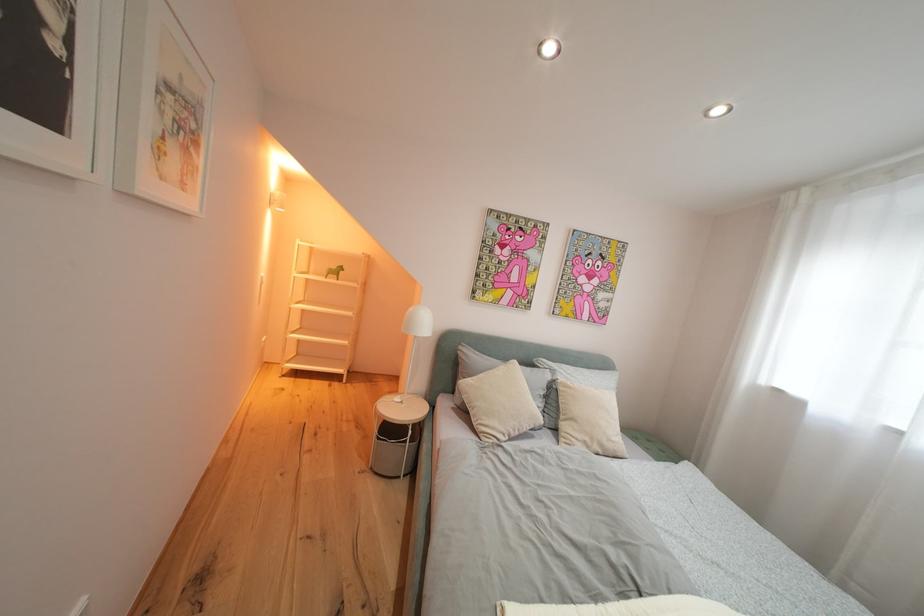
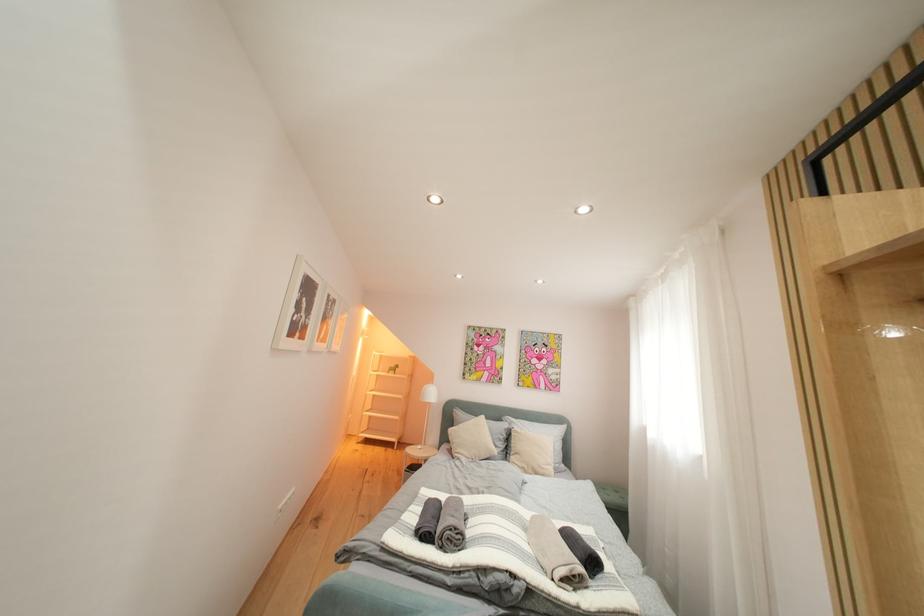
From the picture: Which direction would the cameraman need to move to produce the second image?

The cameraman moved toward right, backward.